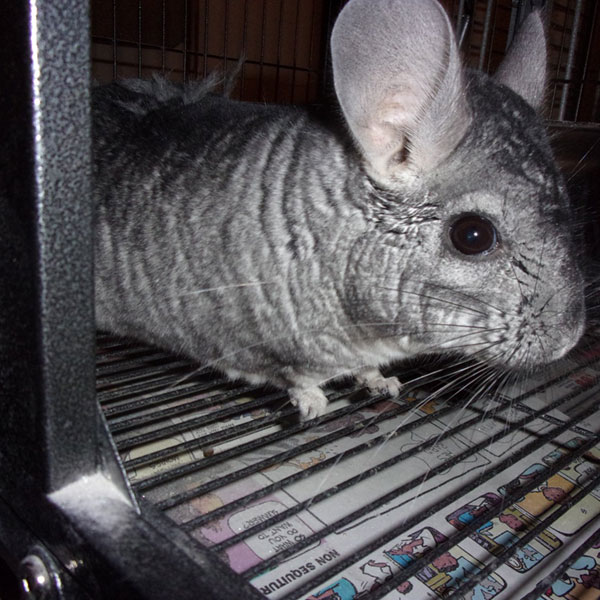
Image resolution: width=600 pixels, height=600 pixels. What are the coordinates of `newspaper, funny pages` in the screenshot? It's located at (433, 485), (226, 493), (462, 564), (573, 522).